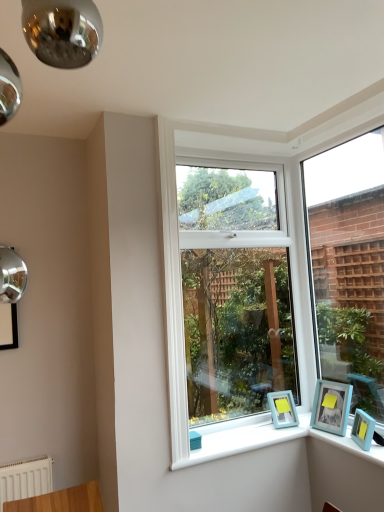
Describe the element at coordinates (331, 407) in the screenshot. I see `light blue plastic picture frame at lower right, the second picture frame viewed from the right` at that location.

This screenshot has height=512, width=384. Describe the element at coordinates (282, 409) in the screenshot. I see `teal matte picture frame at lower right, which appears as the third picture frame when viewed from the right` at that location.

How much space does clear glass window at right, which is counted as the 1th window, starting from the right, occupy vertically?

clear glass window at right, which is counted as the 1th window, starting from the right, is 5.51 feet in height.

Locate an element on the screen. The image size is (384, 512). white plastic window at center, placed as the 2th window when sorted from right to left is located at coordinates (235, 295).

Find the location of a particular element. light blue plastic picture frame at lower right, the second picture frame viewed from the right is located at coordinates (331, 407).

You are a GUI agent. You are given a task and a screenshot of the screen. Output one action in this format:
    pyautogui.click(x=<x>, y=<y>)
    Task: Click on the picture frame that is the 1st one when counting downward from the white plastic window at center, arranged as the 1th window when viewed from the left (from the image's perspective)
    This screenshot has height=512, width=384.
    Given the screenshot: What is the action you would take?
    pyautogui.click(x=331, y=407)

From the image's perspective, which one is positioned higher, light blue plastic picture frame at lower right, the second picture frame viewed from the right, or white plastic window at center, placed as the 2th window when sorted from right to left?

From the image's view, white plastic window at center, placed as the 2th window when sorted from right to left, is above.

Is light blue plastic picture frame at lower right, which ranks as the second picture frame in left-to-right order, bigger or smaller than white plastic window at center, placed as the 2th window when sorted from right to left?

Considering their sizes, light blue plastic picture frame at lower right, which ranks as the second picture frame in left-to-right order, takes up less space than white plastic window at center, placed as the 2th window when sorted from right to left.

From the picture: Is teal matte picture frame at lower right, the 1th picture frame positioned from the left, to the right of white plastic window at center, arranged as the 1th window when viewed from the left, from the viewer's perspective?

Indeed, teal matte picture frame at lower right, the 1th picture frame positioned from the left, is positioned on the right side of white plastic window at center, arranged as the 1th window when viewed from the left.

Which is closer, (296, 411) or (204, 294)?

Clearly, point (296, 411) is closer to the camera than point (204, 294).

Considering the relative sizes of teal matte picture frame at lower right, which appears as the third picture frame when viewed from the right, and white plastic window at center, placed as the 2th window when sorted from right to left, in the image provided, is teal matte picture frame at lower right, which appears as the third picture frame when viewed from the right, taller than white plastic window at center, placed as the 2th window when sorted from right to left,?

No, teal matte picture frame at lower right, which appears as the third picture frame when viewed from the right, is not taller than white plastic window at center, placed as the 2th window when sorted from right to left.

Looking at this image, from the image's perspective, is teal matte picture frame at lower right, which appears as the third picture frame when viewed from the right, located above or below white plastic window at center, arranged as the 1th window when viewed from the left?

Clearly, from the image's perspective, teal matte picture frame at lower right, which appears as the third picture frame when viewed from the right, is below white plastic window at center, arranged as the 1th window when viewed from the left.

Between light blue plastic picture frame at lower right, the first picture frame in the right-to-left sequence, and light blue plastic picture frame at lower right, the second picture frame viewed from the right, which one has less height?

light blue plastic picture frame at lower right, the first picture frame in the right-to-left sequence.

Could you tell me if light blue plastic picture frame at lower right, the 3th picture frame viewed from the left, is facing light blue plastic picture frame at lower right, the second picture frame viewed from the right?

No, light blue plastic picture frame at lower right, the 3th picture frame viewed from the left, is not facing towards light blue plastic picture frame at lower right, the second picture frame viewed from the right.

Does light blue plastic picture frame at lower right, the 3th picture frame viewed from the left, come behind light blue plastic picture frame at lower right, which ranks as the second picture frame in left-to-right order?

No, light blue plastic picture frame at lower right, the 3th picture frame viewed from the left, is in front of light blue plastic picture frame at lower right, which ranks as the second picture frame in left-to-right order.

From a real-world perspective, which object stands above the other?

From a 3D spatial view, light blue plastic picture frame at lower right, which ranks as the second picture frame in left-to-right order, is above.

Is light blue plastic picture frame at lower right, the second picture frame viewed from the right, facing towards teal matte picture frame at lower right, which appears as the third picture frame when viewed from the right?

No, light blue plastic picture frame at lower right, the second picture frame viewed from the right, is not oriented towards teal matte picture frame at lower right, which appears as the third picture frame when viewed from the right.

How many degrees apart are the facing directions of light blue plastic picture frame at lower right, which ranks as the second picture frame in left-to-right order, and teal matte picture frame at lower right, the 1th picture frame positioned from the left?

The facing directions of light blue plastic picture frame at lower right, which ranks as the second picture frame in left-to-right order, and teal matte picture frame at lower right, the 1th picture frame positioned from the left, are 61.5 degrees apart.

Is light blue plastic picture frame at lower right, which ranks as the second picture frame in left-to-right order, thinner than teal matte picture frame at lower right, the 1th picture frame positioned from the left?

Incorrect, the width of light blue plastic picture frame at lower right, which ranks as the second picture frame in left-to-right order, is not less than that of teal matte picture frame at lower right, the 1th picture frame positioned from the left.

Which object is positioned more to the right, light blue plastic picture frame at lower right, the second picture frame viewed from the right, or teal matte picture frame at lower right, which appears as the third picture frame when viewed from the right?

Positioned to the right is light blue plastic picture frame at lower right, the second picture frame viewed from the right.

From the image's perspective, between clear glass window at right, arranged as the second window when viewed from the left, and white plastic window at center, arranged as the 1th window when viewed from the left, which one is located above?

clear glass window at right, arranged as the second window when viewed from the left.

Is clear glass window at right, arranged as the second window when viewed from the left, thinner than white plastic window at center, arranged as the 1th window when viewed from the left?

Yes.

In terms of height, does clear glass window at right, arranged as the second window when viewed from the left, look taller or shorter compared to white plastic window at center, placed as the 2th window when sorted from right to left?

In the image, clear glass window at right, arranged as the second window when viewed from the left, appears to be shorter than white plastic window at center, placed as the 2th window when sorted from right to left.

Is clear glass window at right, arranged as the second window when viewed from the left, not close to white plastic window at center, arranged as the 1th window when viewed from the left?

No.

Considering the relative sizes of white plastic window at center, arranged as the 1th window when viewed from the left, and teal matte picture frame at lower right, which appears as the third picture frame when viewed from the right, in the image provided, is white plastic window at center, arranged as the 1th window when viewed from the left, bigger than teal matte picture frame at lower right, which appears as the third picture frame when viewed from the right,?

Indeed, white plastic window at center, arranged as the 1th window when viewed from the left, has a larger size compared to teal matte picture frame at lower right, which appears as the third picture frame when viewed from the right.

Measure the distance between white plastic window at center, arranged as the 1th window when viewed from the left, and teal matte picture frame at lower right, the 1th picture frame positioned from the left.

white plastic window at center, arranged as the 1th window when viewed from the left, is 37.60 inches from teal matte picture frame at lower right, the 1th picture frame positioned from the left.

Identify the location of the 2nd picture frame directly beneath the white plastic window at center, arranged as the 1th window when viewed from the left (from a real-world perspective). The height and width of the screenshot is (512, 384). (282, 409).

Is white plastic window at center, arranged as the 1th window when viewed from the left, at the left side of teal matte picture frame at lower right, the 1th picture frame positioned from the left?

Yes, white plastic window at center, arranged as the 1th window when viewed from the left, is to the left of teal matte picture frame at lower right, the 1th picture frame positioned from the left.

Is white plastic window at center, placed as the 2th window when sorted from right to left, wider than light blue plastic picture frame at lower right, the first picture frame in the right-to-left sequence?

In fact, white plastic window at center, placed as the 2th window when sorted from right to left, might be narrower than light blue plastic picture frame at lower right, the first picture frame in the right-to-left sequence.

Can you confirm if white plastic window at center, arranged as the 1th window when viewed from the left, is bigger than light blue plastic picture frame at lower right, the 3th picture frame viewed from the left?

Yes.

Find the location of a particular element. The width and height of the screenshot is (384, 512). the 2nd window counting from the left of the light blue plastic picture frame at lower right, the first picture frame in the right-to-left sequence is located at coordinates (235, 295).

The width and height of the screenshot is (384, 512). There is a white plastic window at center, placed as the 2th window when sorted from right to left. What are the coordinates of `the 1st picture frame below it (from the image's perspective)` in the screenshot? It's located at (331, 407).

Where is `the 1st picture frame to the right of the white plastic window at center, placed as the 2th window when sorted from right to left, starting your count from the anchor`? This screenshot has width=384, height=512. the 1st picture frame to the right of the white plastic window at center, placed as the 2th window when sorted from right to left, starting your count from the anchor is located at coordinates (282, 409).

Which object lies further to the anchor point clear glass window at right, which is counted as the 1th window, starting from the right, light blue plastic picture frame at lower right, the 3th picture frame viewed from the left, or teal matte picture frame at lower right, the 1th picture frame positioned from the left?

Among the two, light blue plastic picture frame at lower right, the 3th picture frame viewed from the left, is located further to clear glass window at right, which is counted as the 1th window, starting from the right.

Based on their spatial positions, is light blue plastic picture frame at lower right, the second picture frame viewed from the right, or clear glass window at right, which is counted as the 1th window, starting from the right, closer to teal matte picture frame at lower right, the 1th picture frame positioned from the left?

Among the two, light blue plastic picture frame at lower right, the second picture frame viewed from the right, is located nearer to teal matte picture frame at lower right, the 1th picture frame positioned from the left.

Considering their positions, is teal matte picture frame at lower right, the 1th picture frame positioned from the left, positioned closer to clear glass window at right, arranged as the second window when viewed from the left, than white plastic window at center, arranged as the 1th window when viewed from the left?

Based on the image, white plastic window at center, arranged as the 1th window when viewed from the left, appears to be nearer to clear glass window at right, arranged as the second window when viewed from the left.

Based on their spatial positions, is light blue plastic picture frame at lower right, which ranks as the second picture frame in left-to-right order, or white plastic window at center, placed as the 2th window when sorted from right to left, closer to teal matte picture frame at lower right, which appears as the third picture frame when viewed from the right?

light blue plastic picture frame at lower right, which ranks as the second picture frame in left-to-right order.

When comparing their distances from light blue plastic picture frame at lower right, which ranks as the second picture frame in left-to-right order, does clear glass window at right, arranged as the second window when viewed from the left, or white plastic window at center, arranged as the 1th window when viewed from the left, seem further?

white plastic window at center, arranged as the 1th window when viewed from the left, is further to light blue plastic picture frame at lower right, which ranks as the second picture frame in left-to-right order.

Looking at the image, which one is located further to light blue plastic picture frame at lower right, the 3th picture frame viewed from the left, clear glass window at right, which is counted as the 1th window, starting from the right, or teal matte picture frame at lower right, which appears as the third picture frame when viewed from the right?

The object further to light blue plastic picture frame at lower right, the 3th picture frame viewed from the left, is clear glass window at right, which is counted as the 1th window, starting from the right.

Considering their positions, is light blue plastic picture frame at lower right, the 3th picture frame viewed from the left, positioned closer to white plastic window at center, placed as the 2th window when sorted from right to left, than light blue plastic picture frame at lower right, which ranks as the second picture frame in left-to-right order?

light blue plastic picture frame at lower right, which ranks as the second picture frame in left-to-right order.

Looking at the image, which one is located closer to light blue plastic picture frame at lower right, the first picture frame in the right-to-left sequence, light blue plastic picture frame at lower right, which ranks as the second picture frame in left-to-right order, or white plastic window at center, placed as the 2th window when sorted from right to left?

light blue plastic picture frame at lower right, which ranks as the second picture frame in left-to-right order, lies closer to light blue plastic picture frame at lower right, the first picture frame in the right-to-left sequence, than the other object.

Find the location of a particular element. window between clear glass window at right, arranged as the second window when viewed from the left, and teal matte picture frame at lower right, the 1th picture frame positioned from the left, from top to bottom is located at coordinates coord(235,295).

Locate an element on the screen. Image resolution: width=384 pixels, height=512 pixels. window between clear glass window at right, arranged as the second window when viewed from the left, and light blue plastic picture frame at lower right, the first picture frame in the right-to-left sequence, in the up-down direction is located at coordinates (235, 295).

The image size is (384, 512). Identify the location of picture frame between clear glass window at right, arranged as the second window when viewed from the left, and light blue plastic picture frame at lower right, the first picture frame in the right-to-left sequence, in the vertical direction. (331, 407).

At what (x,y) coordinates should I click in order to perform the action: click on window that lies between clear glass window at right, arranged as the second window when viewed from the left, and light blue plastic picture frame at lower right, the second picture frame viewed from the right, from top to bottom. Please return your answer as a coordinate pair (x, y). The height and width of the screenshot is (512, 384). Looking at the image, I should click on (235, 295).